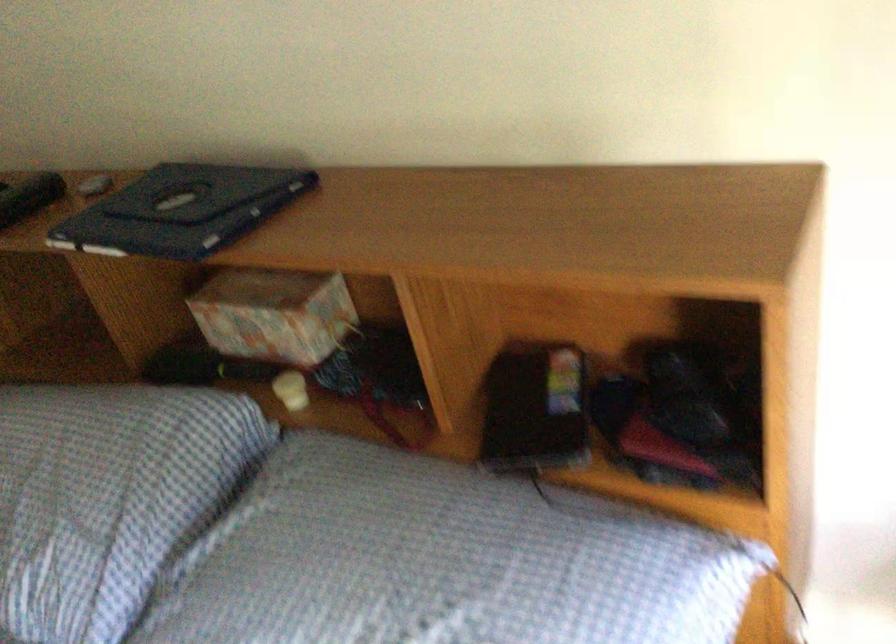
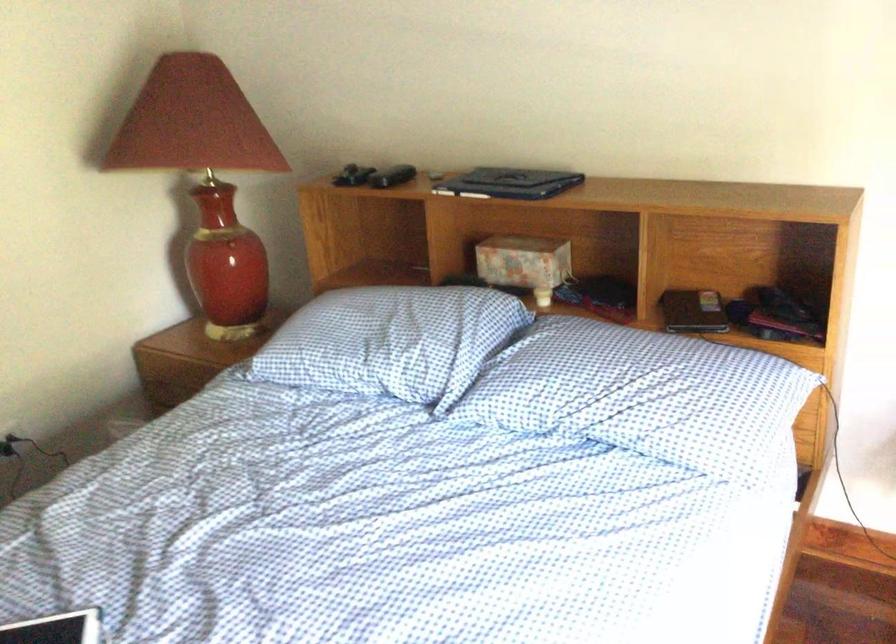
The point at (170, 221) is marked in the first image. Where is the corresponding point in the second image?

(510, 183)